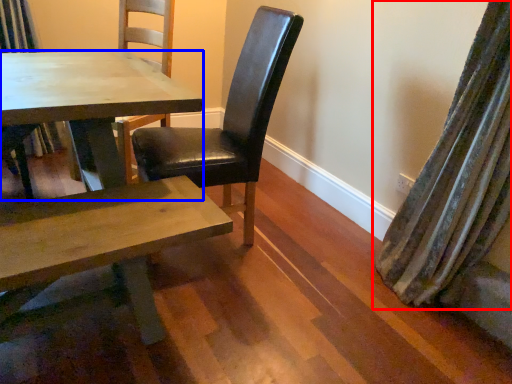
Question: Which object appears closest to the camera in this image, curtain (highlighted by a red box) or kitchen & dining room table (highlighted by a blue box)?

Choices:
 (A) curtain
 (B) kitchen & dining room table

Answer: (A)